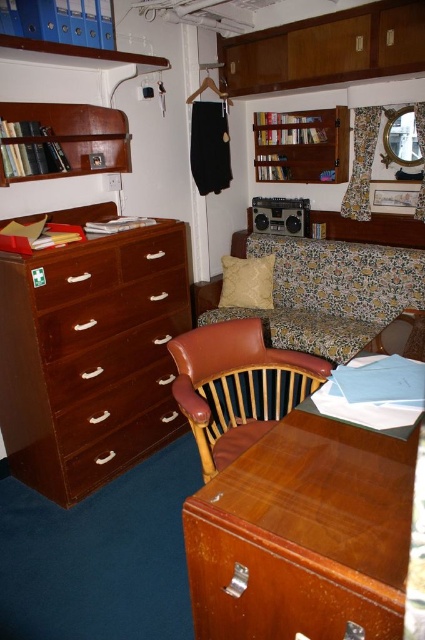
Question: Which point appears farthest from the camera in this image?

Choices:
 (A) (319, 554)
 (B) (181, 232)

Answer: (B)

Question: Among these objects, which one is farthest from the camera?

Choices:
 (A) matte brown drawer at left
 (B) wooden bookcase at upper center
 (C) brown wood drawer at center

Answer: (B)

Question: Which of the following is the farthest from the observer?

Choices:
 (A) glossy wood table at lower center
 (B) matte wood drawer at left
 (C) brown leather armchair at center

Answer: (B)

Question: Is matte brown drawer at left thinner than beige fabric pillow at center?

Choices:
 (A) no
 (B) yes

Answer: (A)

Question: Observing the image, what is the correct spatial positioning of wooden bookshelf at upper left in reference to matte wood drawer at left?

Choices:
 (A) below
 (B) above

Answer: (B)

Question: Does floral fabric couch at center have a lesser width compared to matte wood drawer at lower left?

Choices:
 (A) no
 (B) yes

Answer: (A)